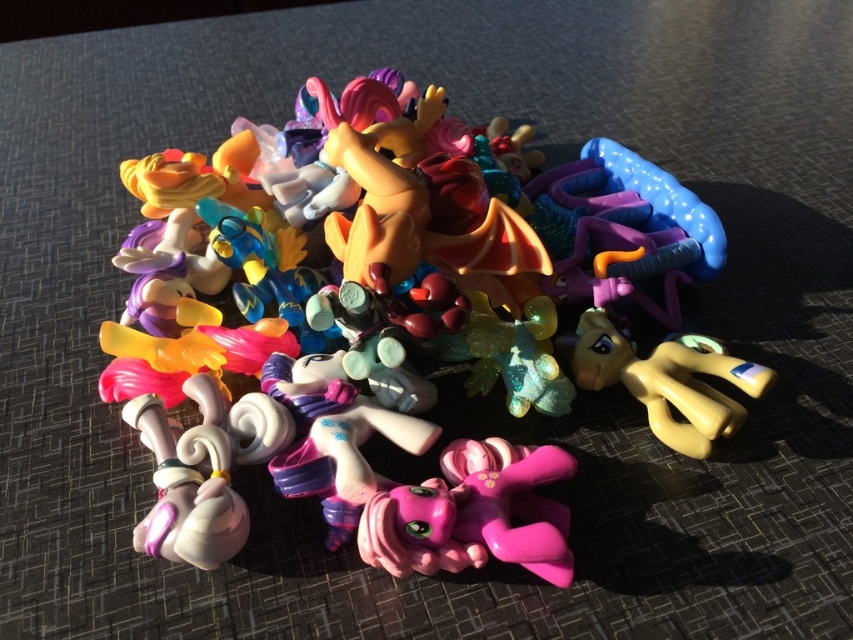
You are organizing a toy display and need to place a new figurine exactly where the glossy plastic pony at center is currently located. Where should you place the new figurine?

You should place the new figurine at point (407,332) where the glossy plastic pony at center is located.

You are looking at the arrangement of two points in the image. Which point is closer to you, point (563, 260) or point (670, 340)?

Point (563, 260) is closer to you than point (670, 340).

You are holding a camera and want to take a closeup photo of the glossy plastic pony at center. The camera requires a minimum distance of 1 meter to focus properly. Can you take the photo without moving the pony?

The glossy plastic pony at center and camera are 96.99 centimeters apart from each other. Since 96.99 cm is less than 1 meter, the camera cannot focus properly. Move the camera back to at least 1 meter away to take the photo.